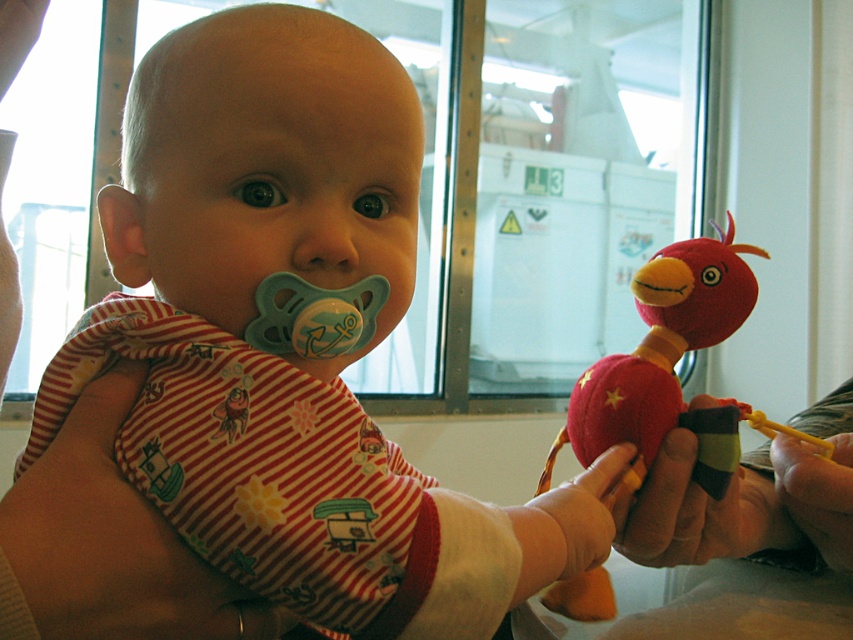
You are a photographer trying to capture a closeup of the baby in the image. You need to focus on either the matte plastic pacifier at center or the fuzzy fabric bird at right. Which object should you focus on to ensure it appears larger in the photo?

The matte plastic pacifier at center is closer to the viewer, so focusing on it will make it appear larger in the photo compared to the fuzzy fabric bird at right.

In the scene shown: You are a photographer taking a picture of the baby. You need to ensure that both the matte plastic pacifier at center and the fuzzy fabric bird at right are clearly visible in the frame. Which object should you focus on to ensure both are in focus?

You should focus on the matte plastic pacifier at center because it is smaller and closer to the camera, ensuring both it and the fuzzy fabric bird at right are in focus.